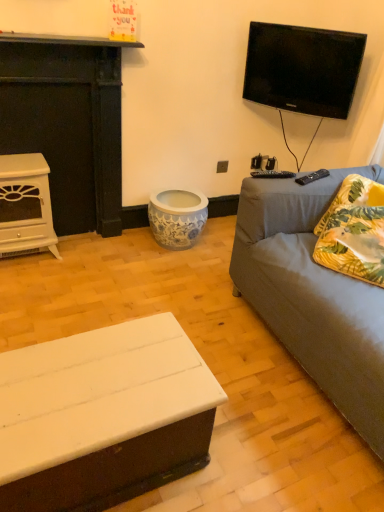
At what (x,y) coordinates should I click in order to perform the action: click on empty space that is ontop of white matte coffee table at lower left (from a real-world perspective). Please return your answer as a coordinate pair (x, y). The height and width of the screenshot is (512, 384). Looking at the image, I should click on (103, 370).